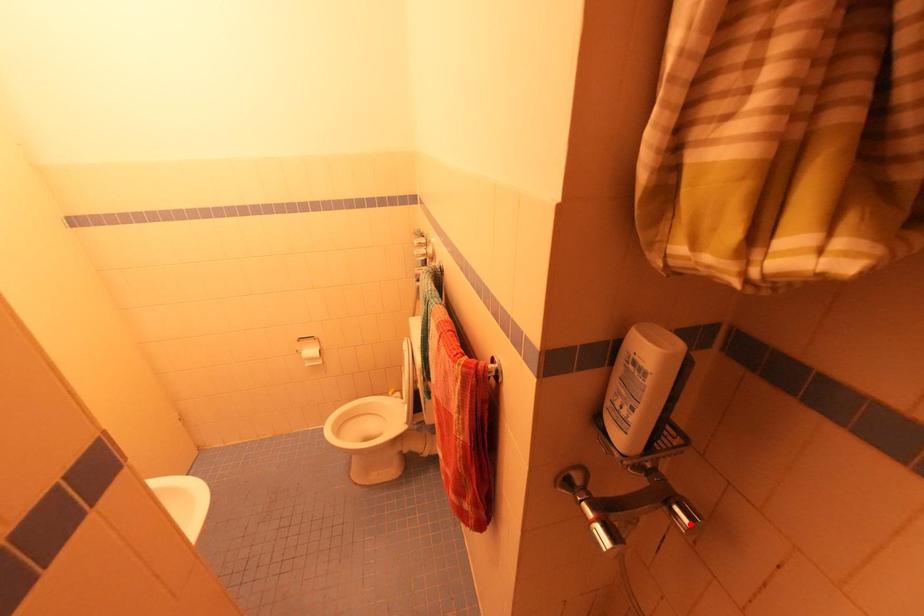
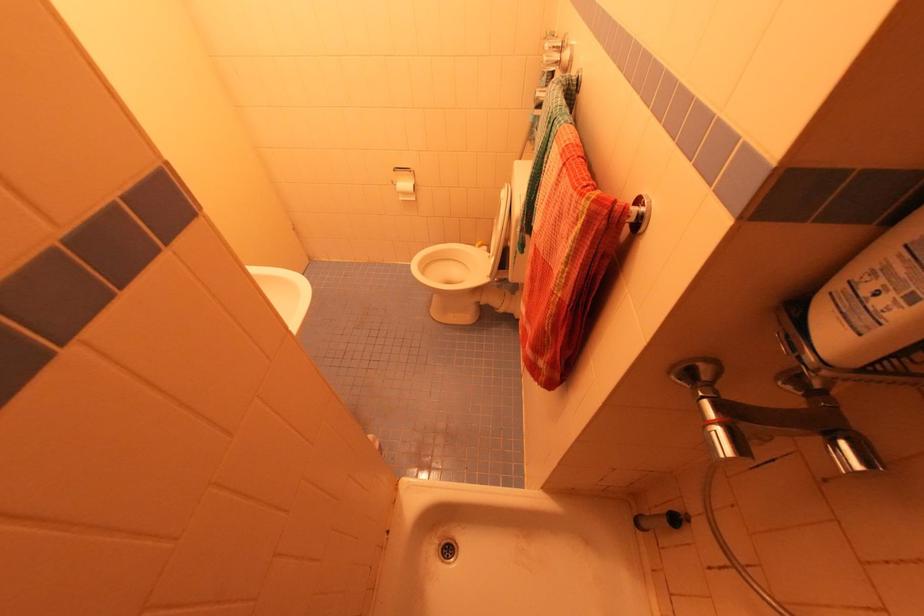
Find the pixel in the second image that matches the highlighted location in the first image.

(859, 467)